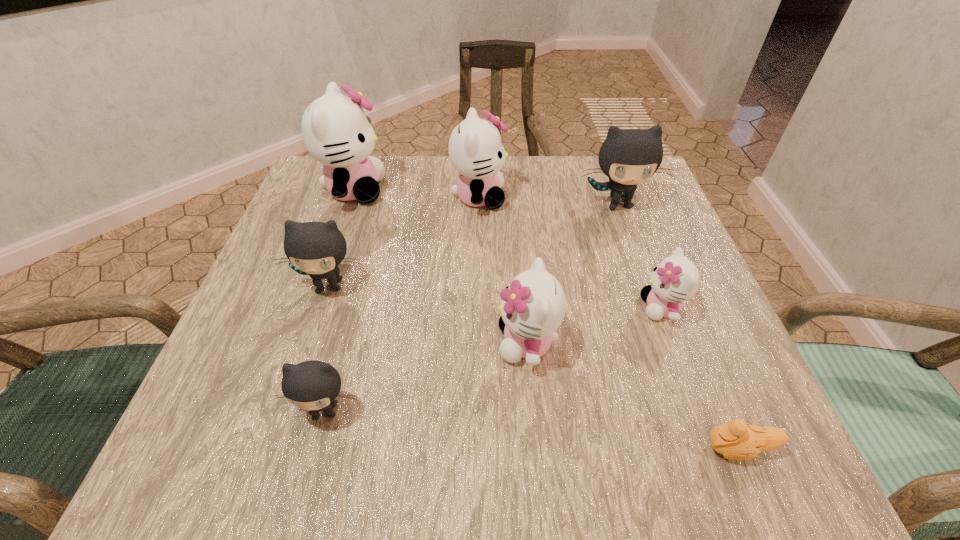
Locate an element on the screen. The height and width of the screenshot is (540, 960). vacant point located on the front-facing side of the rightmost white kitten is located at coordinates (494, 307).

Image resolution: width=960 pixels, height=540 pixels. I want to click on free space located 0.210m on the front-facing side of the rightmost white kitten, so click(522, 307).

The image size is (960, 540). In order to click on blank space located 0.340m on the face of the nearest object in this screenshot , I will do `click(457, 448)`.

Find the location of a particular element. vacant space positioned on the face of the nearest object is located at coordinates (594, 448).

Find the location of a particular element. blank space located on the face of the nearest object is located at coordinates (580, 448).

This screenshot has width=960, height=540. What are the coordinates of `kitten that is at the near edge` in the screenshot? It's located at [x=313, y=385].

Locate an element on the screen. The image size is (960, 540). duckling that is at the near edge is located at coordinates (737, 440).

The image size is (960, 540). I want to click on duckling positioned at the right edge, so click(737, 440).

I want to click on object that is at the far left corner, so click(x=336, y=132).

Where is `object situated at the near left corner`? The width and height of the screenshot is (960, 540). object situated at the near left corner is located at coordinates (313, 385).